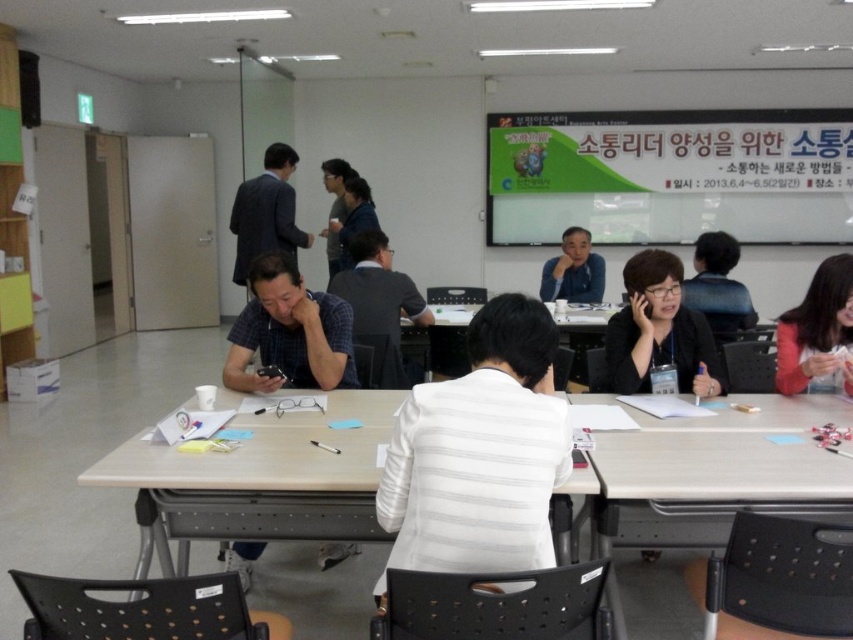
Can you confirm if matte black jacket at lower right is positioned below matte gray shirt at center?

Correct, matte black jacket at lower right is located below matte gray shirt at center.

Measure the distance from matte black jacket at lower right to matte gray shirt at center.

They are 1.92 meters apart.

Which is behind, point (809, 374) or point (343, 269)?

The point (343, 269) is behind.

You are a GUI agent. You are given a task and a screenshot of the screen. Output one action in this format:
    pyautogui.click(x=<x>, y=<y>)
    Task: Click on the matte black jacket at lower right
    This screenshot has width=853, height=640.
    Given the screenshot: What is the action you would take?
    pyautogui.click(x=817, y=330)

Between matte black jacket at lower right and blue fabric shirt at center, which one is positioned lower?

matte black jacket at lower right is lower down.

Who is positioned more to the right, matte black jacket at lower right or blue fabric shirt at center?

matte black jacket at lower right is more to the right.

Between point (851, 312) and point (602, 284), which one is positioned behind?

The point (602, 284) is behind.

Locate an element on the screen. Image resolution: width=853 pixels, height=640 pixels. matte black jacket at lower right is located at coordinates (817, 330).

Is white striped blazer at center below light brown wooden table at center?

No.

Who is more distant from viewer, (500, 321) or (202, 499)?

Point (202, 499)

Locate an element on the screen. The width and height of the screenshot is (853, 640). white striped blazer at center is located at coordinates (480, 452).

The height and width of the screenshot is (640, 853). Find the location of `white striped blazer at center`. white striped blazer at center is located at coordinates (480, 452).